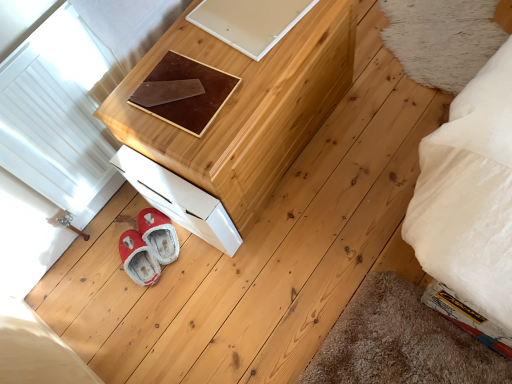
Identify the location of free location in front of brown leather pad at center. (198, 134).